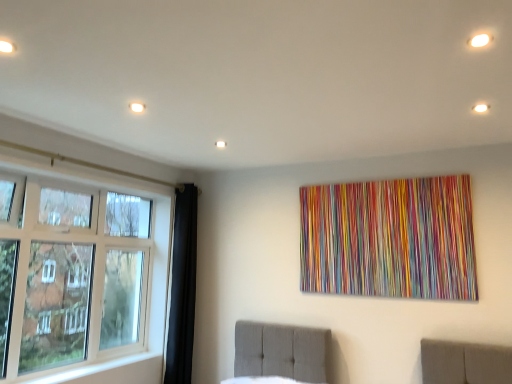
Question: Could you tell me if white glass window at left is facing white glossy light at upper right, marked as the 1th light in a right-to-left arrangement?

Choices:
 (A) yes
 (B) no

Answer: (A)

Question: Does white glass window at left have a greater height compared to white glossy light at upper right, which is the second light from left to right?

Choices:
 (A) yes
 (B) no

Answer: (A)

Question: From the image's perspective, is white glass window at left above white glossy light at upper right, marked as the 1th light in a right-to-left arrangement?

Choices:
 (A) no
 (B) yes

Answer: (A)

Question: From a real-world perspective, is white glass window at left physically above white glossy light at upper right, marked as the 1th light in a right-to-left arrangement?

Choices:
 (A) no
 (B) yes

Answer: (A)

Question: Is white glass window at left shorter than white glossy light at upper right, which is the second light from left to right?

Choices:
 (A) no
 (B) yes

Answer: (A)

Question: Does white glass window at left touch white glossy light at upper right, which is the second light from left to right?

Choices:
 (A) yes
 (B) no

Answer: (B)

Question: From a real-world perspective, is white matte light fixture at upper left, the 1th light positioned from the left, positioned over white glossy light at upper right, marked as the 1th light in a right-to-left arrangement, based on gravity?

Choices:
 (A) yes
 (B) no

Answer: (B)

Question: From a real-world perspective, does white matte light fixture at upper left, the 1th light positioned from the left, sit lower than white glossy light at upper right, marked as the 1th light in a right-to-left arrangement?

Choices:
 (A) no
 (B) yes

Answer: (B)

Question: Considering the relative sizes of white matte light fixture at upper left, the 1th light positioned from the left, and white glossy light at upper right, which is the second light from left to right, in the image provided, is white matte light fixture at upper left, the 1th light positioned from the left, bigger than white glossy light at upper right, which is the second light from left to right,?

Choices:
 (A) no
 (B) yes

Answer: (A)

Question: Considering the relative sizes of white matte light fixture at upper left, the 1th light positioned from the left, and white glossy light at upper right, which is the second light from left to right, in the image provided, is white matte light fixture at upper left, the 1th light positioned from the left, wider than white glossy light at upper right, which is the second light from left to right,?

Choices:
 (A) no
 (B) yes

Answer: (A)

Question: Is white matte light fixture at upper left, the second light in the right-to-left sequence, to the left of white glossy light at upper right, which is the second light from left to right, from the viewer's perspective?

Choices:
 (A) no
 (B) yes

Answer: (B)

Question: From the image's perspective, is white matte light fixture at upper left, the second light in the right-to-left sequence, under white glossy light at upper right, which is the second light from left to right?

Choices:
 (A) yes
 (B) no

Answer: (B)

Question: Considering the relative sizes of white glossy light at upper right, which is the second light from left to right, and white glass window at left in the image provided, is white glossy light at upper right, which is the second light from left to right, thinner than white glass window at left?

Choices:
 (A) no
 (B) yes

Answer: (B)